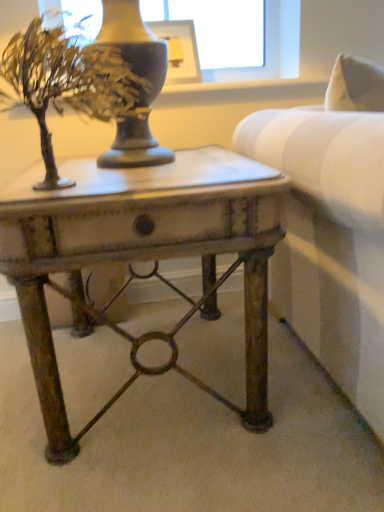
Question: Is point (173, 74) positioned closer to the camera than point (91, 93)?

Choices:
 (A) farther
 (B) closer

Answer: (A)

Question: In the image, is matte black picture frame at upper center on the left side or the right side of metallic gold tree at upper left?

Choices:
 (A) left
 (B) right

Answer: (B)

Question: Which of these objects is positioned closest to the metallic gold tree at upper left?

Choices:
 (A) matte black picture frame at upper center
 (B) rustic metal table at center

Answer: (B)

Question: Which object is positioned farthest from the metallic gold tree at upper left?

Choices:
 (A) rustic metal table at center
 (B) matte black picture frame at upper center

Answer: (B)